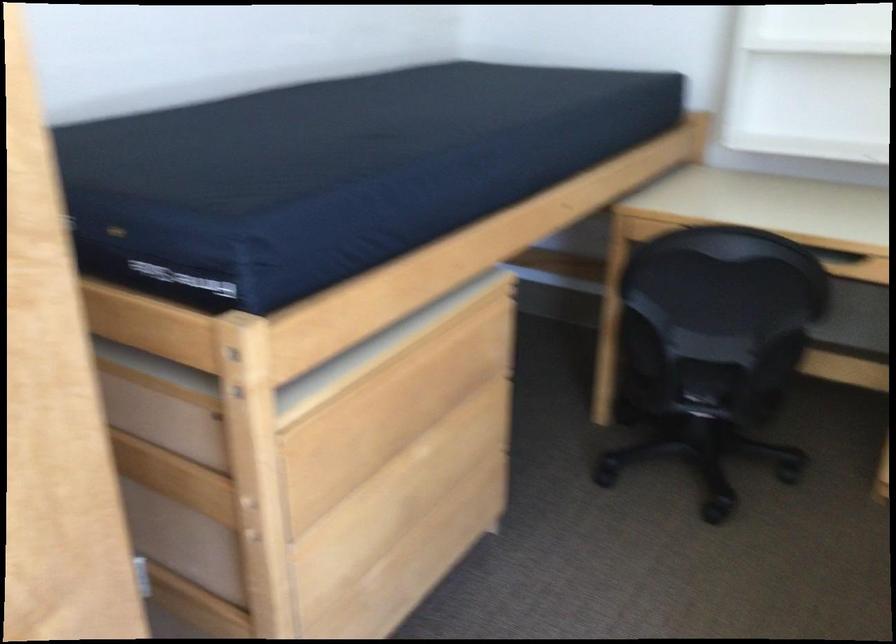
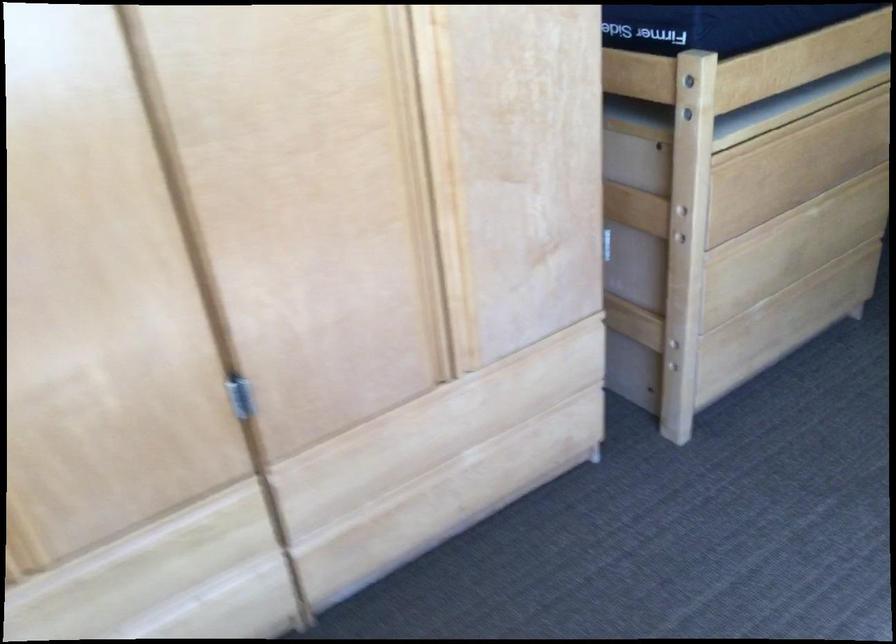
Locate, in the second image, the point that corresponds to point (399, 529) in the first image.

(778, 269)